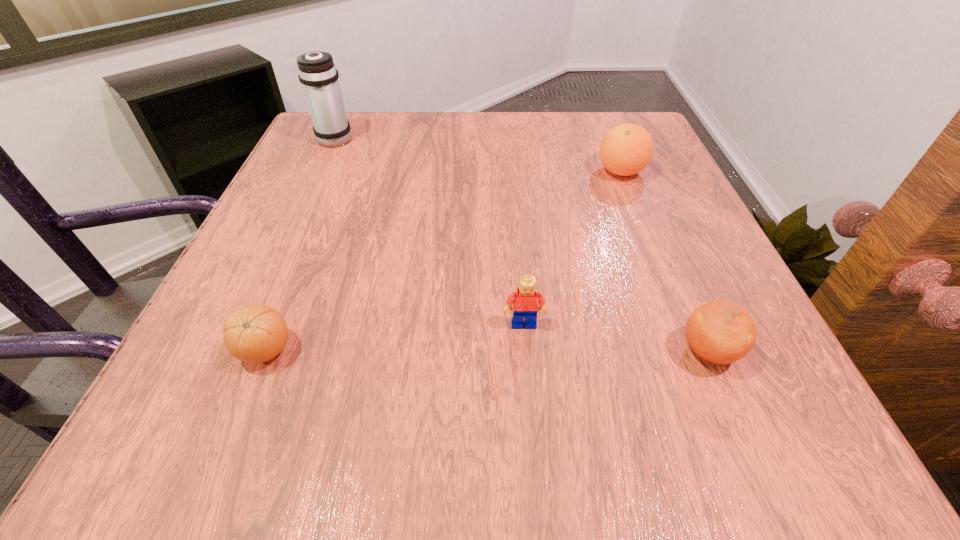
Locate an element on the screen. The image size is (960, 540). vacant area at the near left corner of the desktop is located at coordinates (235, 421).

At what (x,y) coordinates should I click in order to perform the action: click on vacant space at the far right corner. Please return your answer as a coordinate pair (x, y). The height and width of the screenshot is (540, 960). Looking at the image, I should click on (667, 159).

This screenshot has width=960, height=540. In order to click on free spot between the thermos bottle and the shortest orange in this screenshot , I will do `click(300, 244)`.

Where is `free spot between the shortest orange and the fourth nearest object`? Image resolution: width=960 pixels, height=540 pixels. free spot between the shortest orange and the fourth nearest object is located at coordinates (444, 261).

At what (x,y) coordinates should I click in order to perform the action: click on free space between the fourth nearest object and the Lego. Please return your answer as a coordinate pair (x, y). Looking at the image, I should click on point(572,248).

Where is `free space between the shortest orange and the third object from right to left`? The width and height of the screenshot is (960, 540). free space between the shortest orange and the third object from right to left is located at coordinates (395, 337).

Identify which object is the fourth nearest to the third object from left to right. Please provide its 2D coordinates. Your answer should be formatted as a tuple, i.e. [(x, y)], where the tuple contains the x and y coordinates of a point satisfying the conditions above.

[(317, 73)]

You are a GUI agent. You are given a task and a screenshot of the screen. Output one action in this format:
    pyautogui.click(x=<x>, y=<y>)
    Task: Click on the object that stands as the third closest to the leftmost orange
    The width and height of the screenshot is (960, 540).
    Given the screenshot: What is the action you would take?
    pyautogui.click(x=719, y=331)

Choose which orange is the nearest neighbor to the third object from right to left. Please provide its 2D coordinates. Your answer should be formatted as a tuple, i.e. [(x, y)], where the tuple contains the x and y coordinates of a point satisfying the conditions above.

[(719, 331)]

Identify the location of orange that stands as the second closest to the farthest orange. This screenshot has width=960, height=540. (256, 333).